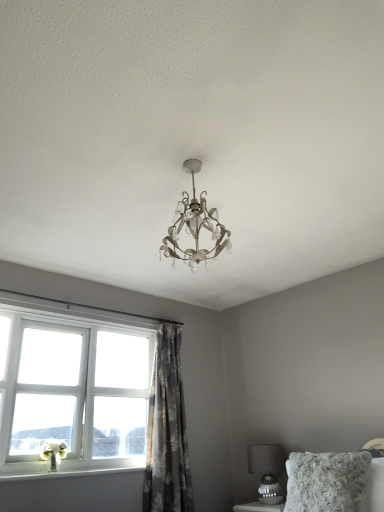
Question: Is point (162, 480) closer or farther from the camera than point (51, 477)?

Choices:
 (A) closer
 (B) farther

Answer: (B)

Question: Is gray floral fabric curtain at center wider or thinner than white painted wood at lower left?

Choices:
 (A) wide
 (B) thin

Answer: (A)

Question: Based on their relative distances, which object is farther from the metallic silver table lamp at lower right?

Choices:
 (A) white painted wood at lower left
 (B) fluffy white pillow at lower right
 (C) gray floral fabric curtain at center
 (D) white plastic window at lower left

Answer: (D)

Question: Estimate the real-world distances between objects in this image. Which object is closer to the gray floral fabric curtain at center?

Choices:
 (A) white plastic window at lower left
 (B) white painted wood at lower left
 (C) metallic silver table lamp at lower right
 (D) fluffy white pillow at lower right

Answer: (A)